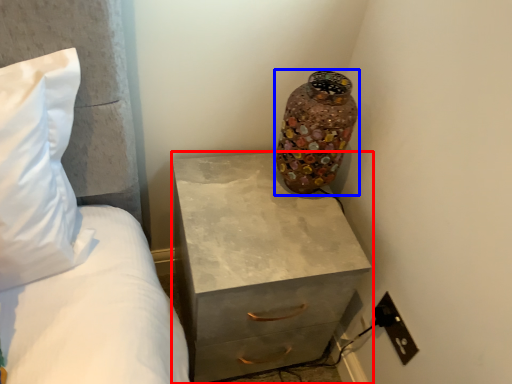
Question: Which object is further to the camera taking this photo, chest of drawers (highlighted by a red box) or vase (highlighted by a blue box)?

Choices:
 (A) chest of drawers
 (B) vase

Answer: (B)